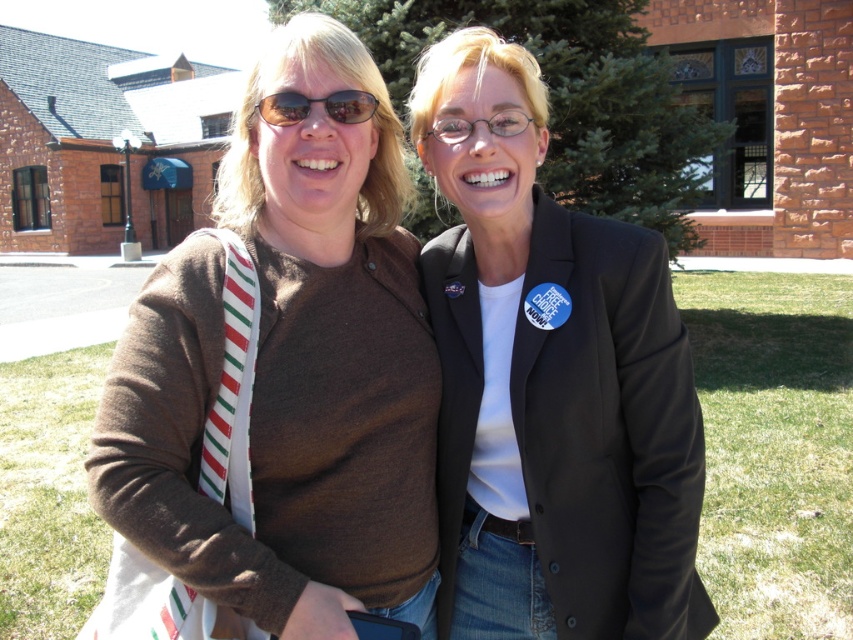
You are a fashion designer analyzing the image. The black matte blazer at center is part of a collection. Where on the body would this blazer be worn?

The black matte blazer at center is worn on the upper body, as it is positioned at point coordinates indicating it is on the torso area of the person.